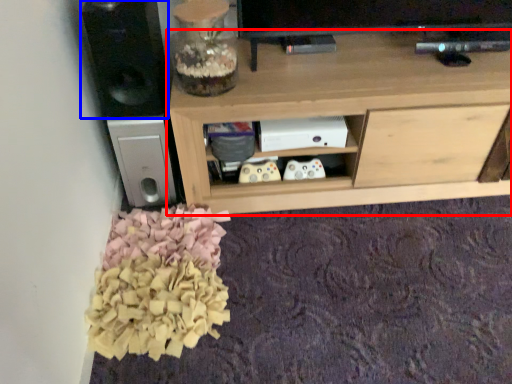
Question: Which object is closer to the camera taking this photo, shelf (highlighted by a red box) or speaker (highlighted by a blue box)?

Choices:
 (A) shelf
 (B) speaker

Answer: (B)